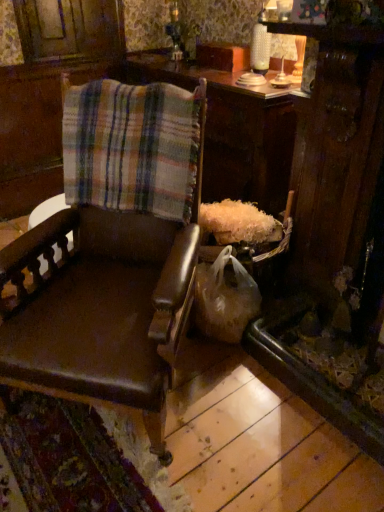
Question: From the image's perspective, is brown leather chair at left under wooden table at center?

Choices:
 (A) yes
 (B) no

Answer: (A)

Question: Can you confirm if brown leather chair at left is wider than wooden table at center?

Choices:
 (A) yes
 (B) no

Answer: (A)

Question: Is brown leather chair at left positioned beyond the bounds of wooden table at center?

Choices:
 (A) yes
 (B) no

Answer: (A)

Question: Is wooden table at center located within brown leather chair at left?

Choices:
 (A) no
 (B) yes

Answer: (A)

Question: From a real-world perspective, is brown leather chair at left located higher than wooden table at center?

Choices:
 (A) no
 (B) yes

Answer: (B)

Question: From a real-world perspective, is brown leather chair at left positioned above or below plaid fabric at center?

Choices:
 (A) below
 (B) above

Answer: (A)

Question: Considering the positions of brown leather chair at left and plaid fabric at center in the image, is brown leather chair at left taller or shorter than plaid fabric at center?

Choices:
 (A) tall
 (B) short

Answer: (A)

Question: Considering the positions of brown leather chair at left and plaid fabric at center in the image, is brown leather chair at left wider or thinner than plaid fabric at center?

Choices:
 (A) thin
 (B) wide

Answer: (B)

Question: From the image's perspective, is brown leather chair at left positioned above or below plaid fabric at center?

Choices:
 (A) below
 (B) above

Answer: (A)

Question: From a real-world perspective, is brown leather chair at left positioned above or below wooden table at center?

Choices:
 (A) above
 (B) below

Answer: (A)

Question: In terms of width, does brown leather chair at left look wider or thinner when compared to wooden table at center?

Choices:
 (A) wide
 (B) thin

Answer: (A)

Question: Is point (81, 271) positioned closer to the camera than point (254, 136)?

Choices:
 (A) farther
 (B) closer

Answer: (B)

Question: Is brown leather chair at left bigger or smaller than wooden table at center?

Choices:
 (A) small
 (B) big

Answer: (A)

Question: Is wooden table at center bigger or smaller than brown leather chair at left?

Choices:
 (A) big
 (B) small

Answer: (A)

Question: Is point (246, 166) positioned closer to the camera than point (92, 224)?

Choices:
 (A) closer
 (B) farther

Answer: (B)